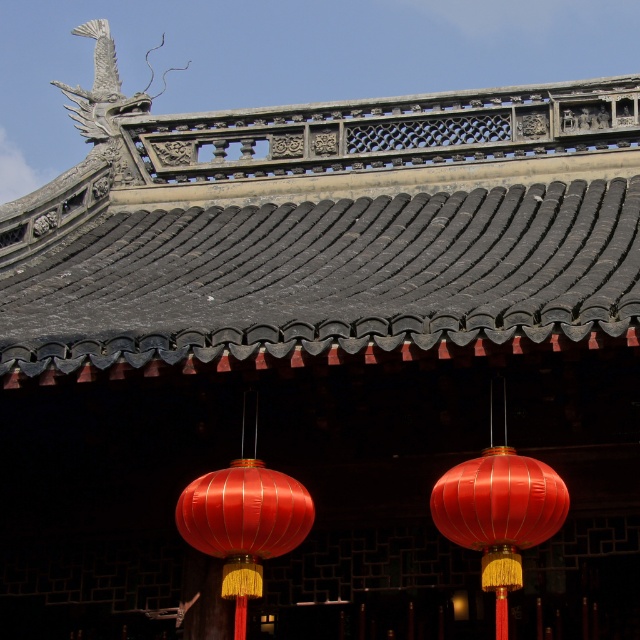
Question: From the image, what is the correct spatial relationship of dark gray textured tiles at upper center in relation to shiny red silk lantern at center?

Choices:
 (A) left
 (B) right

Answer: (A)

Question: Is shiny red silk lantern at center to the right of satin red lantern at center from the viewer's perspective?

Choices:
 (A) no
 (B) yes

Answer: (B)

Question: Which point is closer to the camera taking this photo?

Choices:
 (A) (273, 340)
 (B) (241, 484)
 (C) (541, 465)

Answer: (B)

Question: Can you confirm if dark gray textured tiles at upper center is positioned above satin red lantern at center?

Choices:
 (A) yes
 (B) no

Answer: (A)

Question: Which of the following is the closest to the observer?

Choices:
 (A) shiny red silk lantern at center
 (B) dark gray textured tiles at upper center

Answer: (A)

Question: Which of the following is the closest to the observer?

Choices:
 (A) shiny red silk lantern at center
 (B) dark gray textured tiles at upper center
 (C) satin red lantern at center

Answer: (A)